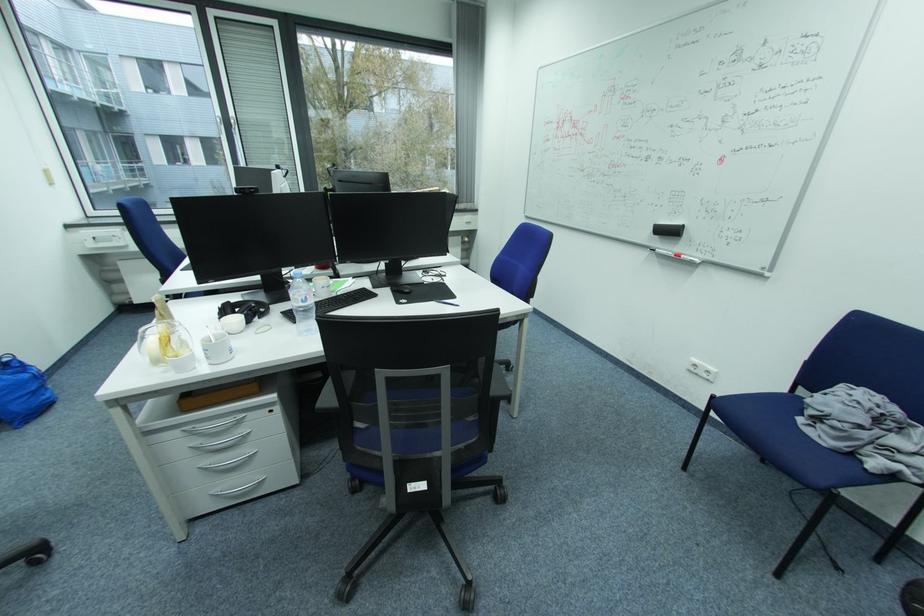
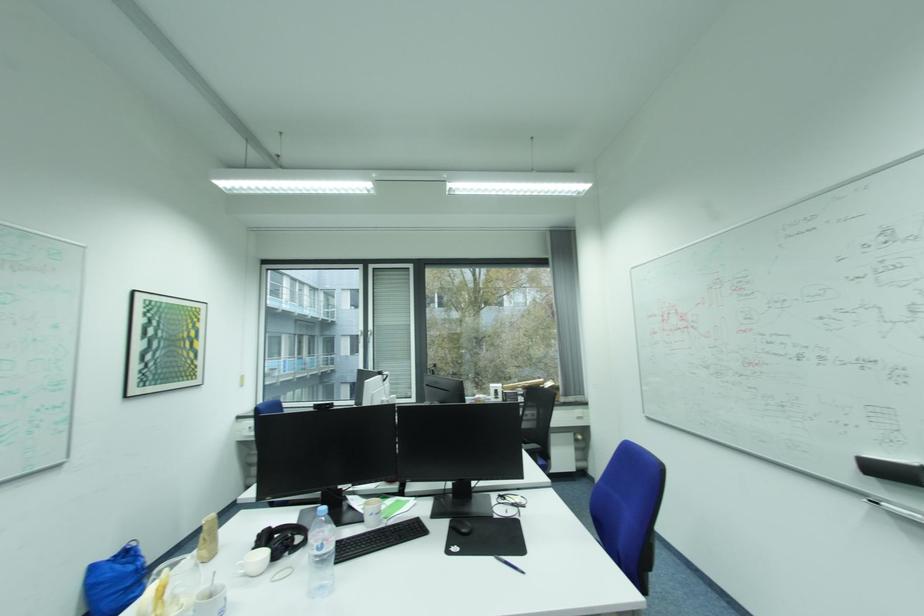
In the second image, find the point that corresponds to the point at 229,318 in the first image.

(261, 551)